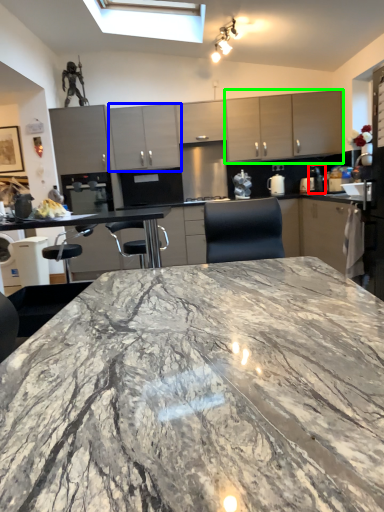
Question: Considering the real-world distances, which object is farthest from coffee machine (highlighted by a red box)? cabinetry (highlighted by a blue box) or cabinetry (highlighted by a green box)?

Choices:
 (A) cabinetry
 (B) cabinetry

Answer: (A)